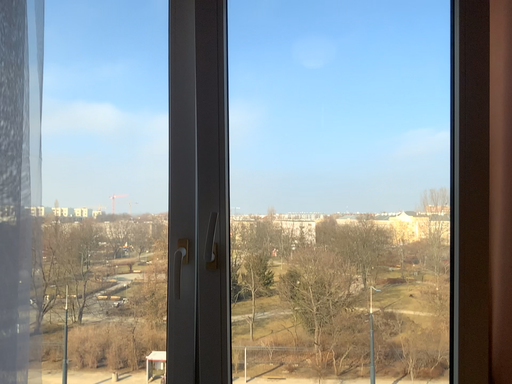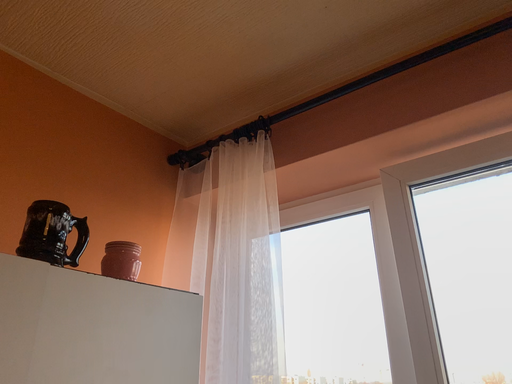
Question: Which way did the camera rotate in the video?

Choices:
 (A) rotated right
 (B) rotated left

Answer: (B)